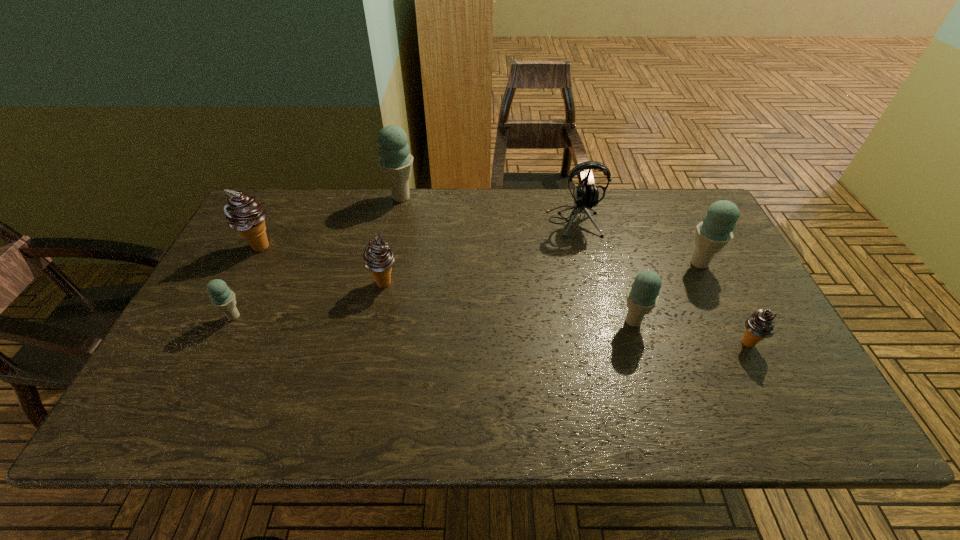
Locate an element on the screen. The height and width of the screenshot is (540, 960). blank region between the smallest blue ice cream and the fifth ice cream from left to right is located at coordinates (434, 319).

Locate an element on the screen. vacant region between the second farthest chocolate icecream and the black earphone is located at coordinates (479, 252).

I want to click on free space between the black earphone and the farthest ice cream, so click(x=488, y=210).

Locate an element on the screen. The image size is (960, 540). free space that is in between the third ice cream from right to left and the rightmost chocolate icecream is located at coordinates point(690,332).

You are a GUI agent. You are given a task and a screenshot of the screen. Output one action in this format:
    pyautogui.click(x=<x>, y=<y>)
    Task: Click on the free point between the third blue ice cream from right to left and the second farthest chocolate icecream
    Image resolution: width=960 pixels, height=540 pixels.
    Given the screenshot: What is the action you would take?
    pos(393,240)

I want to click on vacant region between the biggest chocolate icecream and the farthest blue ice cream, so click(331, 222).

This screenshot has width=960, height=540. I want to click on blank region between the smallest blue ice cream and the earphone, so click(404, 269).

Where is `vacant area that lies between the nearest chocolate icecream and the farthest blue ice cream`? The image size is (960, 540). vacant area that lies between the nearest chocolate icecream and the farthest blue ice cream is located at coordinates (574, 271).

At what (x,y) coordinates should I click in order to perform the action: click on blank region between the second smallest chocolate icecream and the farthest chocolate icecream. Please return your answer as a coordinate pair (x, y). The width and height of the screenshot is (960, 540). Looking at the image, I should click on (323, 265).

Identify which object is the closest to the rightmost blue ice cream. Please provide its 2D coordinates. Your answer should be formatted as a tuple, i.e. [(x, y)], where the tuple contains the x and y coordinates of a point satisfying the conditions above.

[(760, 325)]